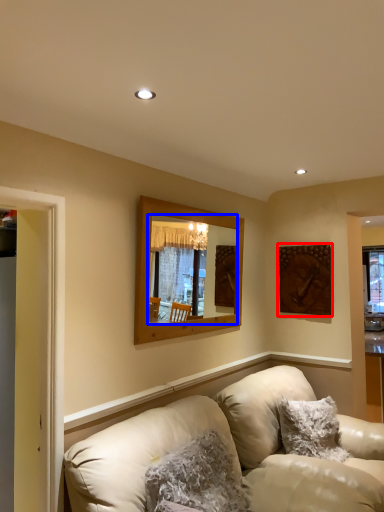
Question: Which point is further to the camera, picture frame (highlighted by a red box) or mirror (highlighted by a blue box)?

Choices:
 (A) picture frame
 (B) mirror

Answer: (A)